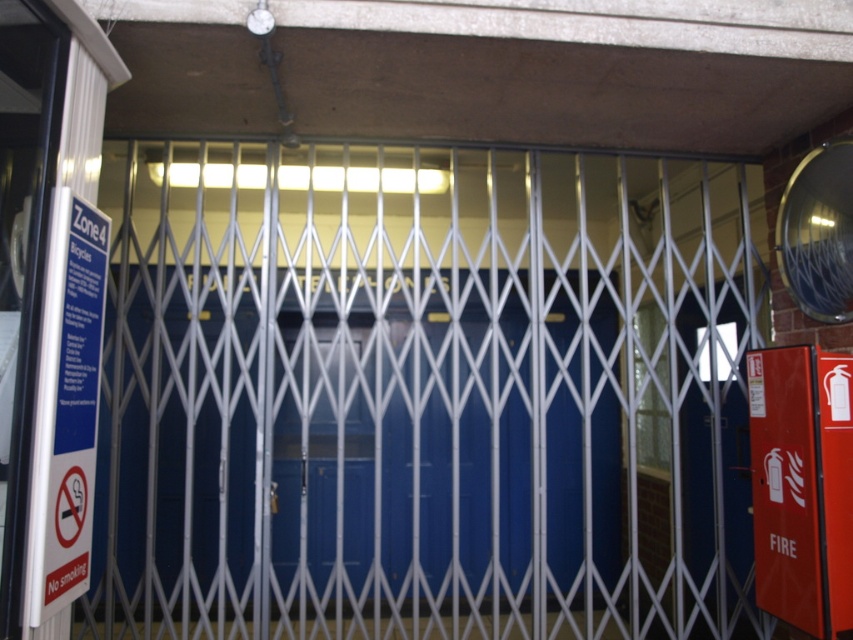
Question: Observing the image, what is the correct spatial positioning of metallic blue elevator at center in reference to red matte fire extinguisher at right?

Choices:
 (A) below
 (B) above

Answer: (B)

Question: Among these objects, which one is farthest from the camera?

Choices:
 (A) red matte fire extinguisher at right
 (B) metallic blue elevator at center

Answer: (B)

Question: Does metallic blue elevator at center appear on the left side of red matte fire extinguisher at right?

Choices:
 (A) no
 (B) yes

Answer: (B)

Question: Is metallic blue elevator at center wider than red matte fire extinguisher at right?

Choices:
 (A) yes
 (B) no

Answer: (A)

Question: Which point is farther from the camera taking this photo?

Choices:
 (A) (757, 417)
 (B) (97, 524)

Answer: (B)